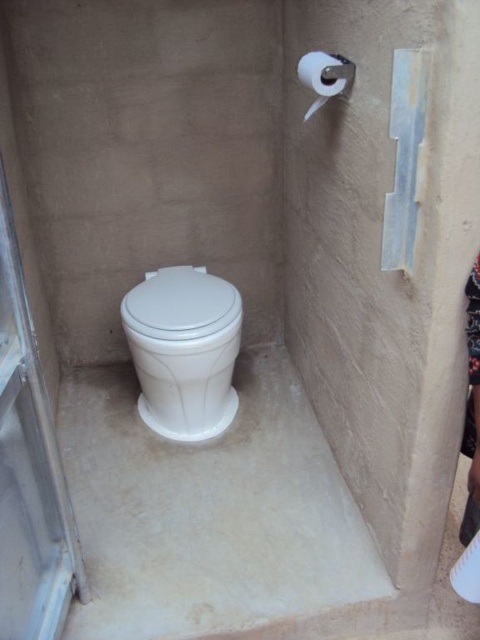
Question: Which point is closer to the camera?

Choices:
 (A) (199, 276)
 (B) (2, 449)
 (C) (314, 102)
 (D) (163, 326)

Answer: (B)

Question: From the image, what is the correct spatial relationship of clear plastic screen door at left in relation to white glossy toilet lid at center?

Choices:
 (A) right
 (B) left

Answer: (B)

Question: Based on their relative distances, which object is farther from the white matte toilet paper at upper right?

Choices:
 (A) white glossy toilet lid at center
 (B) clear plastic screen door at left

Answer: (B)

Question: Does white glossy toilet at center have a larger size compared to white matte toilet paper at upper right?

Choices:
 (A) yes
 (B) no

Answer: (A)

Question: From the image, what is the correct spatial relationship of white glossy toilet at center in relation to white glossy toilet lid at center?

Choices:
 (A) left
 (B) right

Answer: (B)

Question: Which point appears farthest from the camera in this image?

Choices:
 (A) (186, 301)
 (B) (48, 611)
 (C) (315, 74)
 (D) (145, 298)

Answer: (D)